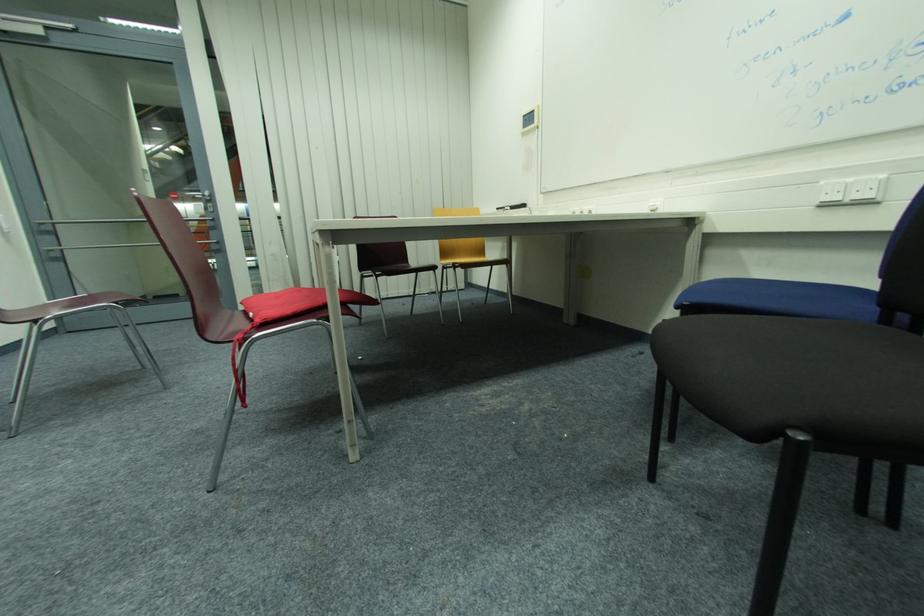
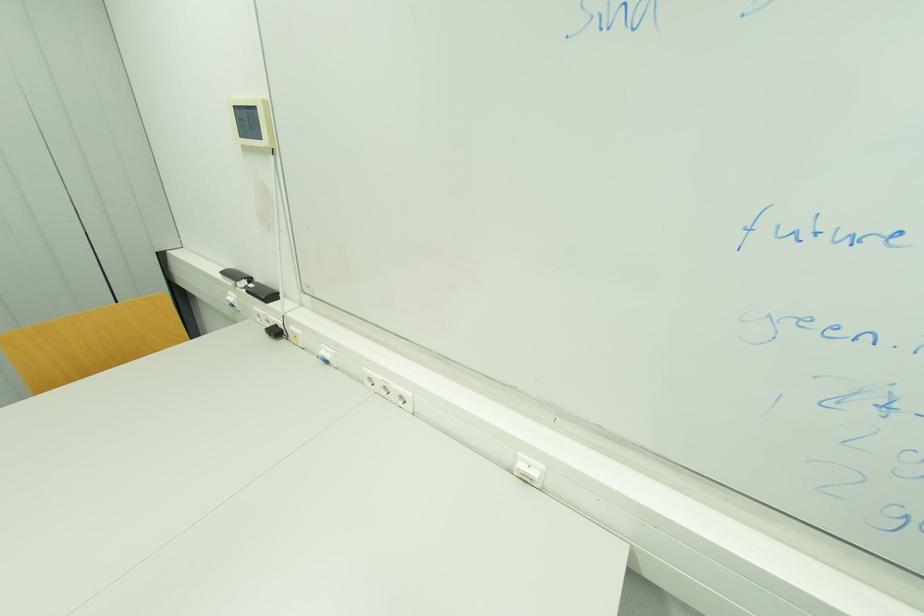
Question: I am providing you with two images of the same scene from different viewpoints. After the viewpoint changes to image2, which objects are now occluded?

Choices:
 (A) white network socket
 (B) white power socket
 (C) black plug
 (D) none of these

Answer: (D)